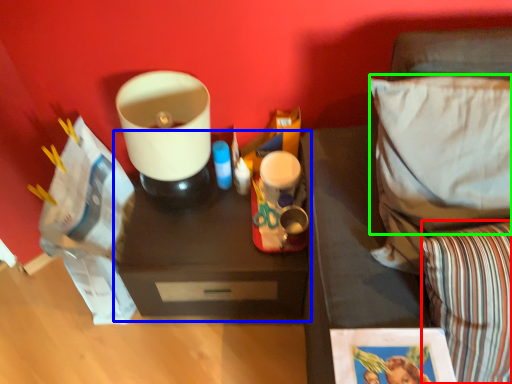
Question: Which is farther away from pillow (highlighted by a red box)? table (highlighted by a blue box) or pillow (highlighted by a green box)?

Choices:
 (A) table
 (B) pillow

Answer: (A)